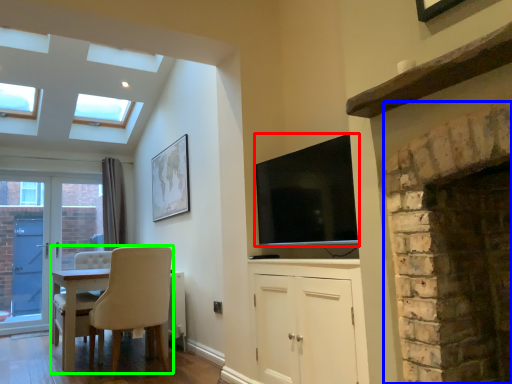
Question: Based on their relative distances, which object is nearer to television (highlighted by a red box)? Choose from fireplace (highlighted by a blue box) and chair (highlighted by a green box).

Choices:
 (A) fireplace
 (B) chair

Answer: (A)